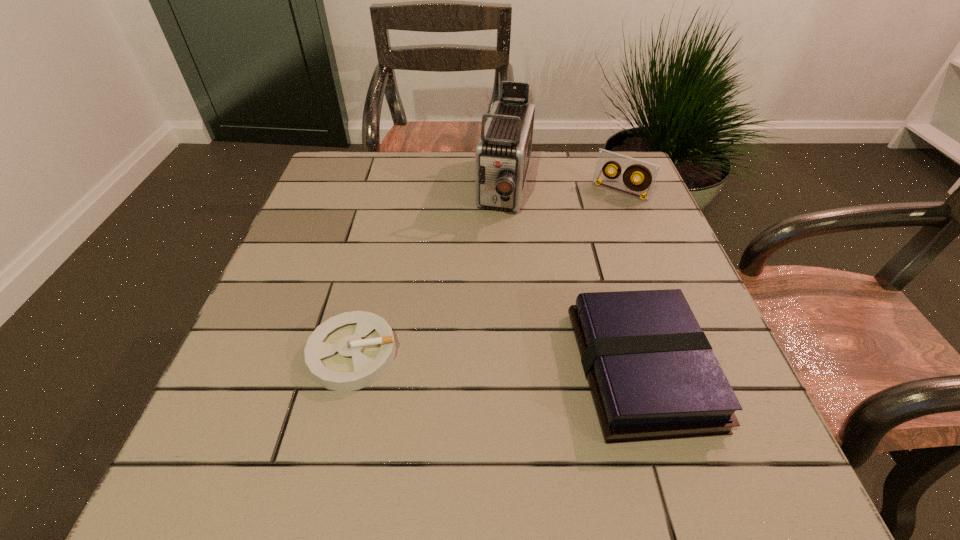
The width and height of the screenshot is (960, 540). What are the coordinates of `ashtray` in the screenshot? It's located at (349, 351).

This screenshot has width=960, height=540. Find the location of `the leftmost object`. the leftmost object is located at coordinates (349, 351).

Image resolution: width=960 pixels, height=540 pixels. I want to click on book, so click(x=652, y=373).

At what (x,y) coordinates should I click in order to perform the action: click on camcorder. Please return your answer as a coordinate pair (x, y). Looking at the image, I should click on point(502,158).

Locate an element on the screen. the third object from right to left is located at coordinates (502, 158).

At what (x,y) coordinates should I click in order to perform the action: click on videotape. Please return your answer as a coordinate pair (x, y). This screenshot has height=540, width=960. Looking at the image, I should click on (647, 172).

Find the location of `vacant space situated on the right of the leftmost object`. vacant space situated on the right of the leftmost object is located at coordinates click(444, 354).

This screenshot has height=540, width=960. In order to click on vacant space located 0.290m on the left of the book in this screenshot , I will do [415, 369].

At what (x,y) coordinates should I click in order to perform the action: click on vacant space positioned at the lens of the camcorder. Please return your answer as a coordinate pair (x, y). Looking at the image, I should click on (483, 303).

Find the location of `free spot located at the lens of the camcorder`. free spot located at the lens of the camcorder is located at coordinates click(x=492, y=264).